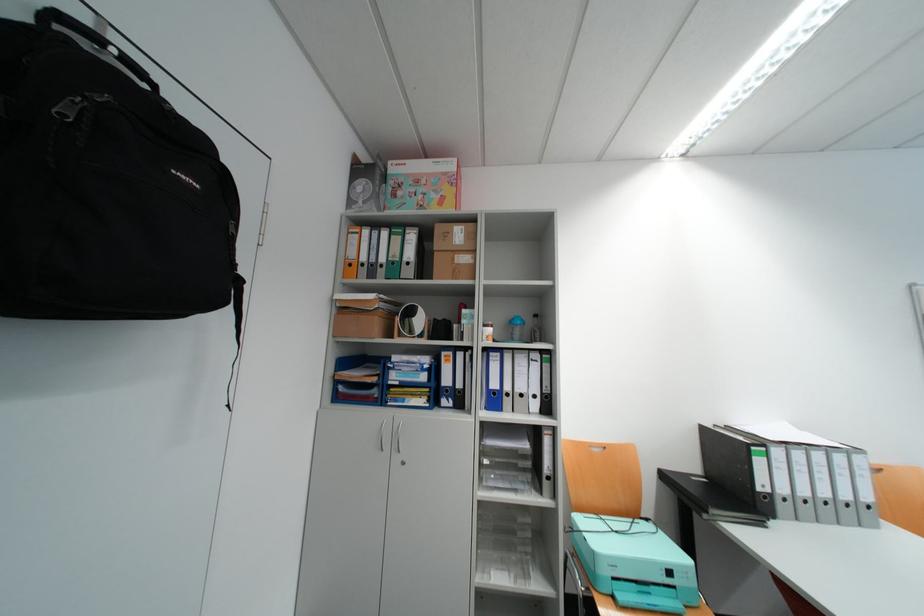
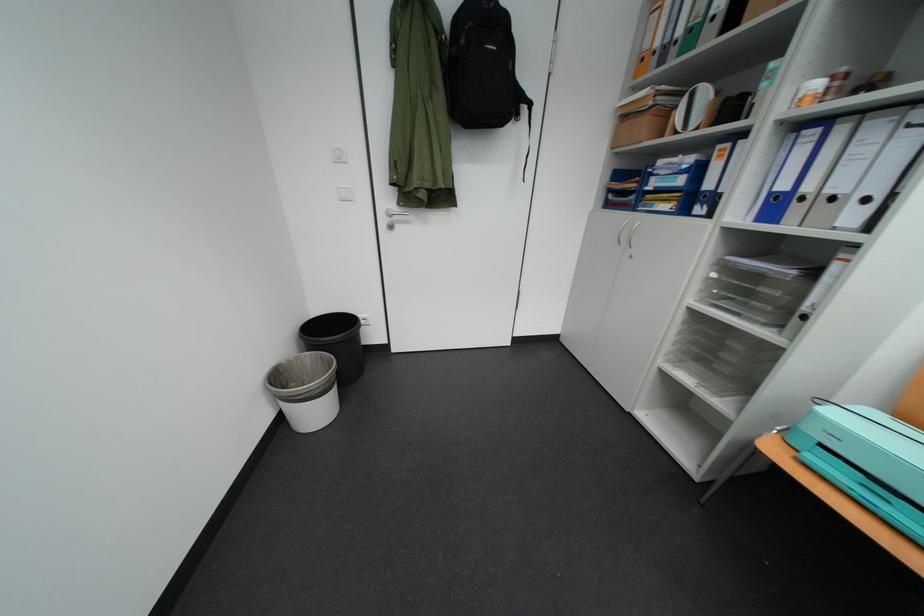
Locate, in the second image, the point that corresponds to (550,588) in the first image.

(730, 403)